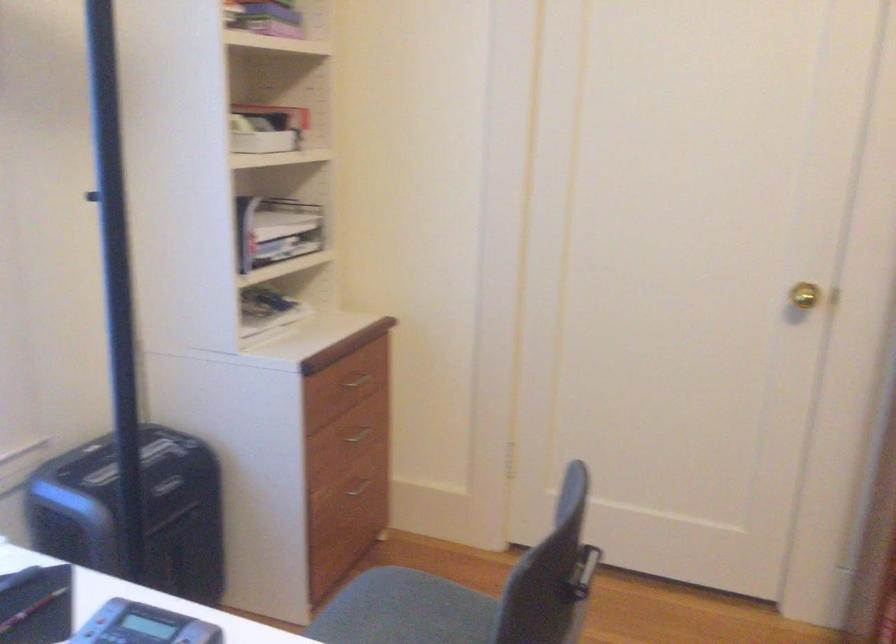
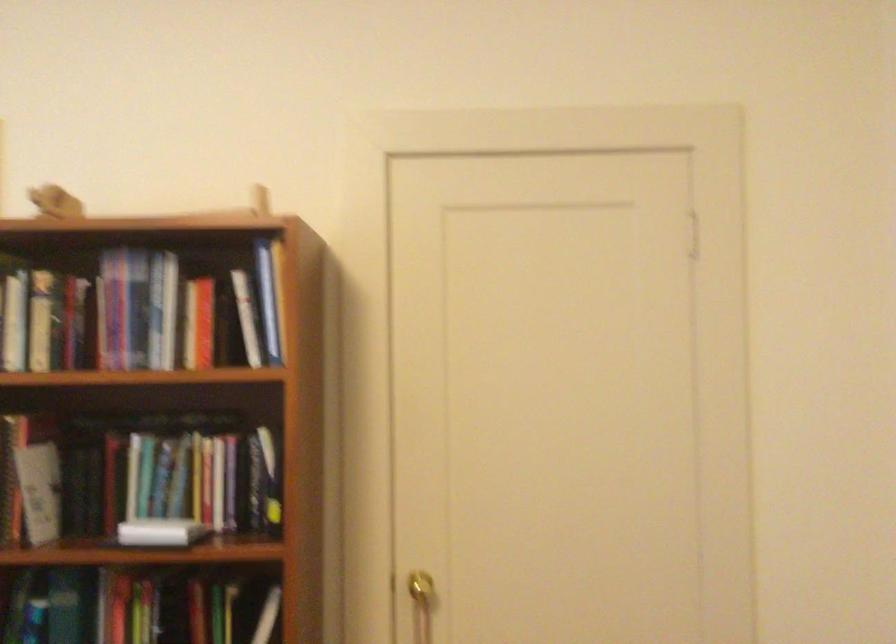
In a continuous first-person perspective shot, in which direction is the camera moving?

The movement direction of the cameraman is right, backward.